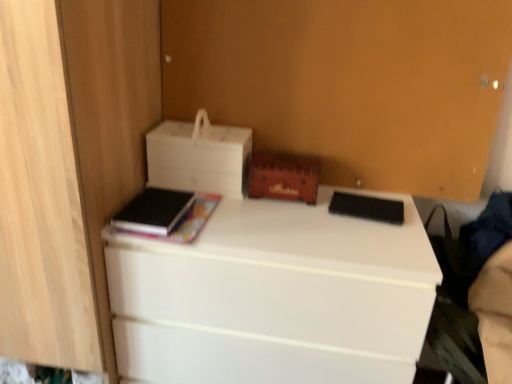
Where is `black matte paperback book at center, the 2th paperback book when ordered from left to right`? black matte paperback book at center, the 2th paperback book when ordered from left to right is located at coordinates (367, 207).

Locate an element on the screen. This screenshot has height=384, width=512. black matte paperback book at center, the first paperback book in the right-to-left sequence is located at coordinates (367, 207).

From the picture: Is white matte desk at center situated inside black matte paperback book at center, the first paperback book in the right-to-left sequence, or outside?

white matte desk at center lies outside black matte paperback book at center, the first paperback book in the right-to-left sequence.

Considering the sizes of objects white matte desk at center and black matte paperback book at center, the 2th paperback book when ordered from left to right, in the image provided, who is shorter, white matte desk at center or black matte paperback book at center, the 2th paperback book when ordered from left to right,?

Standing shorter between the two is black matte paperback book at center, the 2th paperback book when ordered from left to right.

Considering the sizes of white matte desk at center and black matte paperback book at center, the 2th paperback book when ordered from left to right, in the image, is white matte desk at center wider or thinner than black matte paperback book at center, the 2th paperback book when ordered from left to right,?

In the image, white matte desk at center appears to be wider than black matte paperback book at center, the 2th paperback book when ordered from left to right.

Which of these two, white matte desk at center or black matte paperback book at center, the 2th paperback book when ordered from left to right, is bigger?

With larger size is white matte desk at center.

In the scene shown: Measure the distance from wooden chest at center to white matte printer at upper left.

A distance of 5.61 inches exists between wooden chest at center and white matte printer at upper left.

Based on the photo, is the surface of wooden chest at center in direct contact with white matte printer at upper left?

No, wooden chest at center is not touching white matte printer at upper left.

Is wooden chest at center oriented away from white matte printer at upper left?

No, wooden chest at center's orientation is not away from white matte printer at upper left.

From the image's perspective, is black matte book at left, acting as the first paperback book starting from the left, below black matte paperback book at center, the first paperback book in the right-to-left sequence?

No, from the image's perspective, black matte book at left, acting as the first paperback book starting from the left, is not beneath black matte paperback book at center, the first paperback book in the right-to-left sequence.

Can black matte paperback book at center, the first paperback book in the right-to-left sequence, be found inside black matte book at left, acting as the first paperback book starting from the left?

No.

Which point is more forward, (x=164, y=219) or (x=370, y=200)?

Positioned in front is point (x=164, y=219).

Which object is further away from the camera taking this photo, black matte book at left, acting as the first paperback book starting from the left, or black matte paperback book at center, the 2th paperback book when ordered from left to right?

black matte paperback book at center, the 2th paperback book when ordered from left to right, is behind.

From a real-world perspective, is black matte paperback book at center, the 2th paperback book when ordered from left to right, below white matte printer at upper left?

Indeed, from a real-world perspective, black matte paperback book at center, the 2th paperback book when ordered from left to right, is positioned beneath white matte printer at upper left.

Identify the location of printer on the left of black matte paperback book at center, the first paperback book in the right-to-left sequence. This screenshot has height=384, width=512. (199, 157).

Between black matte paperback book at center, the first paperback book in the right-to-left sequence, and white matte printer at upper left, which one is positioned in front?

black matte paperback book at center, the first paperback book in the right-to-left sequence, is closer to the camera.

Does black matte paperback book at center, the first paperback book in the right-to-left sequence, have a lesser height compared to white matte printer at upper left?

Indeed, black matte paperback book at center, the first paperback book in the right-to-left sequence, has a lesser height compared to white matte printer at upper left.

Considering the sizes of white matte printer at upper left and white matte desk at center in the image, is white matte printer at upper left bigger or smaller than white matte desk at center?

Clearly, white matte printer at upper left is smaller in size than white matte desk at center.

Can you confirm if white matte printer at upper left is wider than white matte desk at center?

Incorrect, the width of white matte printer at upper left does not surpass that of white matte desk at center.

From the image's perspective, who appears lower, white matte printer at upper left or white matte desk at center?

white matte desk at center is shown below in the image.

The image size is (512, 384). In order to click on printer that appears above the white matte desk at center (from a real-world perspective) in this screenshot , I will do `click(199, 157)`.

Measure the distance between black matte book at left, acting as the first paperback book starting from the left, and white matte printer at upper left.

The distance of black matte book at left, acting as the first paperback book starting from the left, from white matte printer at upper left is 5.62 inches.

Does point (154, 223) come in front of point (196, 176)?

That is True.

Is black matte book at left, the 2th paperback book positioned from the right, taller than white matte printer at upper left?

No, black matte book at left, the 2th paperback book positioned from the right, is not taller than white matte printer at upper left.

There is a black matte book at left, the 2th paperback book positioned from the right. Where is `printer above it (from a real-world perspective)`? printer above it (from a real-world perspective) is located at coordinates 199,157.

The height and width of the screenshot is (384, 512). In order to click on desk located underneath the black matte paperback book at center, the first paperback book in the right-to-left sequence (from a real-world perspective) in this screenshot , I will do `click(274, 297)`.

Can white matte desk at center be found inside black matte paperback book at center, the first paperback book in the right-to-left sequence?

Actually, white matte desk at center is outside black matte paperback book at center, the first paperback book in the right-to-left sequence.

Who is smaller, black matte paperback book at center, the 2th paperback book when ordered from left to right, or white matte desk at center?

black matte paperback book at center, the 2th paperback book when ordered from left to right, is smaller.

Identify the location of desk below the black matte paperback book at center, the first paperback book in the right-to-left sequence (from the image's perspective). Image resolution: width=512 pixels, height=384 pixels. (274, 297).

Image resolution: width=512 pixels, height=384 pixels. In order to click on printer in front of the wooden chest at center in this screenshot , I will do `click(199, 157)`.

Considering their positions, is black matte paperback book at center, the 2th paperback book when ordered from left to right, positioned further to white matte printer at upper left than white matte desk at center?

black matte paperback book at center, the 2th paperback book when ordered from left to right, lies further to white matte printer at upper left than the other object.

Estimate the real-world distances between objects in this image. Which object is further from black matte book at left, the 2th paperback book positioned from the right, white matte printer at upper left or white matte desk at center?

white matte desk at center lies further to black matte book at left, the 2th paperback book positioned from the right, than the other object.

Considering their positions, is white matte printer at upper left positioned further to white matte desk at center than black matte paperback book at center, the first paperback book in the right-to-left sequence?

Based on the image, black matte paperback book at center, the first paperback book in the right-to-left sequence, appears to be further to white matte desk at center.

Estimate the real-world distances between objects in this image. Which object is further from white matte printer at upper left, black matte book at left, acting as the first paperback book starting from the left, or wooden chest at center?

Among the two, black matte book at left, acting as the first paperback book starting from the left, is located further to white matte printer at upper left.

Looking at the image, which one is located further to black matte book at left, the 2th paperback book positioned from the right, black matte paperback book at center, the 2th paperback book when ordered from left to right, or wooden chest at center?

black matte paperback book at center, the 2th paperback book when ordered from left to right, lies further to black matte book at left, the 2th paperback book positioned from the right, than the other object.

Which object lies further to the anchor point wooden chest at center, white matte desk at center or black matte paperback book at center, the first paperback book in the right-to-left sequence?

white matte desk at center is further to wooden chest at center.

When comparing their distances from wooden chest at center, does black matte paperback book at center, the first paperback book in the right-to-left sequence, or white matte desk at center seem closer?

Based on the image, black matte paperback book at center, the first paperback book in the right-to-left sequence, appears to be nearer to wooden chest at center.

Based on the photo, from the image, which object appears to be nearer to black matte book at left, the 2th paperback book positioned from the right, wooden chest at center or white matte desk at center?

wooden chest at center lies closer to black matte book at left, the 2th paperback book positioned from the right, than the other object.

You are a GUI agent. You are given a task and a screenshot of the screen. Output one action in this format:
    pyautogui.click(x=<x>, y=<y>)
    Task: Click on the storage box between white matte printer at upper left and white matte desk at center in the vertical direction
    
    Given the screenshot: What is the action you would take?
    pyautogui.click(x=284, y=177)

Locate an element on the screen. This screenshot has height=384, width=512. storage box situated between black matte book at left, the 2th paperback book positioned from the right, and black matte paperback book at center, the 2th paperback book when ordered from left to right, from left to right is located at coordinates (284, 177).

Identify the location of printer between black matte book at left, the 2th paperback book positioned from the right, and black matte paperback book at center, the first paperback book in the right-to-left sequence, from left to right. The height and width of the screenshot is (384, 512). (199, 157).

This screenshot has width=512, height=384. What are the coordinates of `printer between black matte book at left, acting as the first paperback book starting from the left, and wooden chest at center from left to right` in the screenshot? It's located at (199, 157).